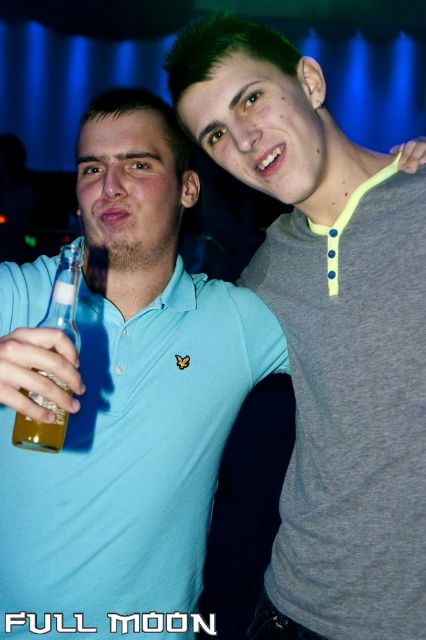
You are standing at point point (77, 426) and want to take a photo of the two people in the scene. The camera you have can focus on subjects within 1.1 meters. Will the camera be able to focus on them?

The distance between point (77, 426) and the camera is 1.09 meters, which is within the camera focus range of 1.1 meters. Therefore, the camera can focus on them.

You are a photographer at the event and need to capture a photo that includes both the gray matte shirt at upper right and the translucent glass bottle at left. Which object should you ensure is placed higher in the frame to maintain their natural positions?

The gray matte shirt at upper right should be placed higher in the frame since it has a greater height compared to the translucent glass bottle at left, maintaining their natural positions.

You are at a party and want to greet both people. Which person should you approach first if you are standing in front of the matte blue polo shirt at left and the gray matte shirt at upper right, and you want to greet the one closer to you?

The matte blue polo shirt at left is positioned on the left side of gray matte shirt at upper right, so if you are standing in front of both, the matte blue polo shirt at left is closer to you and should be greeted first.